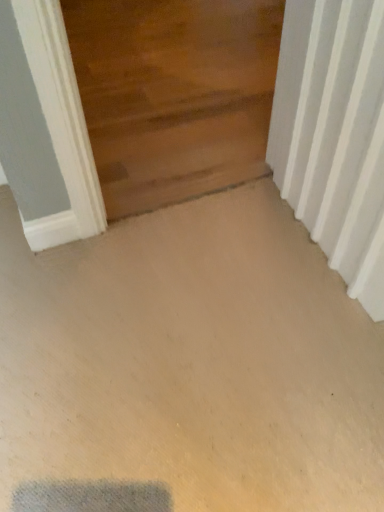
Describe the element at coordinates (334, 135) in the screenshot. I see `white textured radiator at right` at that location.

Locate an element on the screen. Image resolution: width=384 pixels, height=512 pixels. white textured radiator at right is located at coordinates (334, 135).

The image size is (384, 512). What do you see at coordinates (174, 94) in the screenshot?
I see `wooden door at upper center` at bounding box center [174, 94].

Identify the location of wooden door at upper center. (174, 94).

Identify the location of white textured radiator at right. This screenshot has width=384, height=512. (334, 135).

From the picture: Considering the relative positions of white textured radiator at right and wooden door at upper center in the image provided, is white textured radiator at right to the left of wooden door at upper center from the viewer's perspective?

No.

Is white textured radiator at right in front of or behind wooden door at upper center in the image?

Clearly, white textured radiator at right is in front of wooden door at upper center.

Considering the points (274, 113) and (151, 195), which point is in front, point (274, 113) or point (151, 195)?

Point (274, 113)

From the image's perspective, is white textured radiator at right over wooden door at upper center?

No.

From a real-world perspective, is white textured radiator at right under wooden door at upper center?

Incorrect, from a real-world perspective, white textured radiator at right is higher than wooden door at upper center.

Is white textured radiator at right wider than wooden door at upper center?

In fact, white textured radiator at right might be narrower than wooden door at upper center.

Can you confirm if white textured radiator at right is taller than wooden door at upper center?

Correct, white textured radiator at right is much taller as wooden door at upper center.

Who is bigger, white textured radiator at right or wooden door at upper center?

wooden door at upper center.

Can wooden door at upper center be found inside white textured radiator at right?

No.

Are white textured radiator at right and wooden door at upper center beside each other?

No, white textured radiator at right is not making contact with wooden door at upper center.

Is white textured radiator at right looking in the opposite direction of wooden door at upper center?

No, white textured radiator at right's orientation is not away from wooden door at upper center.

Can you tell me how much white textured radiator at right and wooden door at upper center differ in facing direction?

white textured radiator at right and wooden door at upper center are facing 99 degrees away from each other.

This screenshot has height=512, width=384. Identify the location of radiator below the wooden door at upper center (from the image's perspective). (334, 135).

Which is more to the left, wooden door at upper center or white textured radiator at right?

wooden door at upper center.

Does wooden door at upper center come in front of white textured radiator at right?

That is False.

Does point (166, 54) lie behind point (298, 119)?

Yes.

From the image's perspective, between wooden door at upper center and white textured radiator at right, which one is located above?

From the image's view, wooden door at upper center is above.

From a real-world perspective, does wooden door at upper center sit lower than white textured radiator at right?

Yes, from a real-world perspective, wooden door at upper center is under white textured radiator at right.

From the picture: Looking at their sizes, would you say wooden door at upper center is wider or thinner than white textured radiator at right?

Clearly, wooden door at upper center has more width compared to white textured radiator at right.

Between wooden door at upper center and white textured radiator at right, which one has less height?

wooden door at upper center.

Considering the sizes of objects wooden door at upper center and white textured radiator at right in the image provided, who is smaller, wooden door at upper center or white textured radiator at right?

With smaller size is white textured radiator at right.

Is wooden door at upper center outside of white textured radiator at right?

That's correct, wooden door at upper center is outside of white textured radiator at right.

Is wooden door at upper center far away from white textured radiator at right?

No.

Could you tell me if wooden door at upper center is facing white textured radiator at right?

No, wooden door at upper center is not turned towards white textured radiator at right.

Where is `radiator in front of the wooden door at upper center`? This screenshot has width=384, height=512. radiator in front of the wooden door at upper center is located at coordinates coord(334,135).

This screenshot has height=512, width=384. In order to click on door behind the white textured radiator at right in this screenshot , I will do `click(174, 94)`.

Find the location of a particular element. This screenshot has height=512, width=384. radiator below the wooden door at upper center (from the image's perspective) is located at coordinates (334, 135).